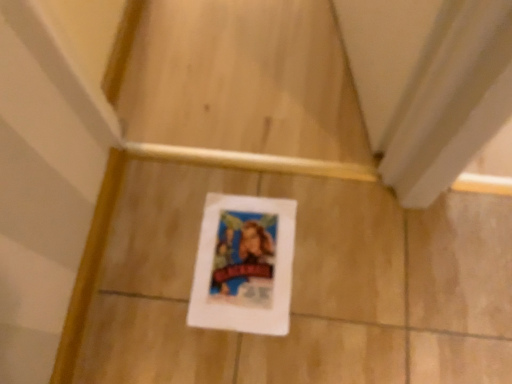
Locate an element on the screen. The image size is (512, 384). vacant region above white paper at center (from a real-world perspective) is located at coordinates (244, 254).